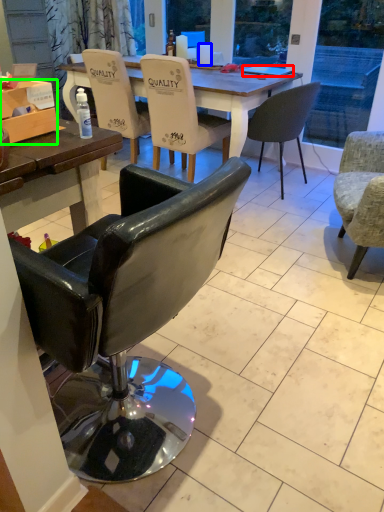
Question: Which object is positioned closest to laptop (highlighted by a red box)? Select from coffee cup (highlighted by a blue box) and box (highlighted by a green box).

Choices:
 (A) coffee cup
 (B) box

Answer: (A)